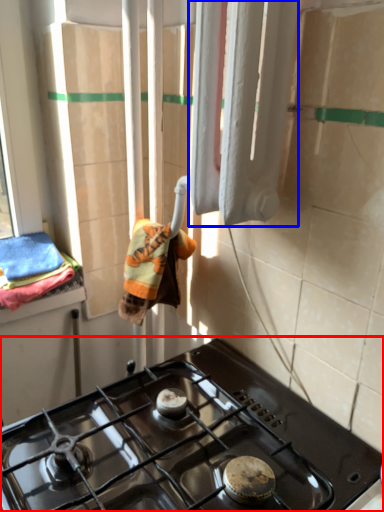
Question: Which point is further to the camera, gas stove (highlighted by a red box) or curtain (highlighted by a blue box)?

Choices:
 (A) gas stove
 (B) curtain

Answer: (B)